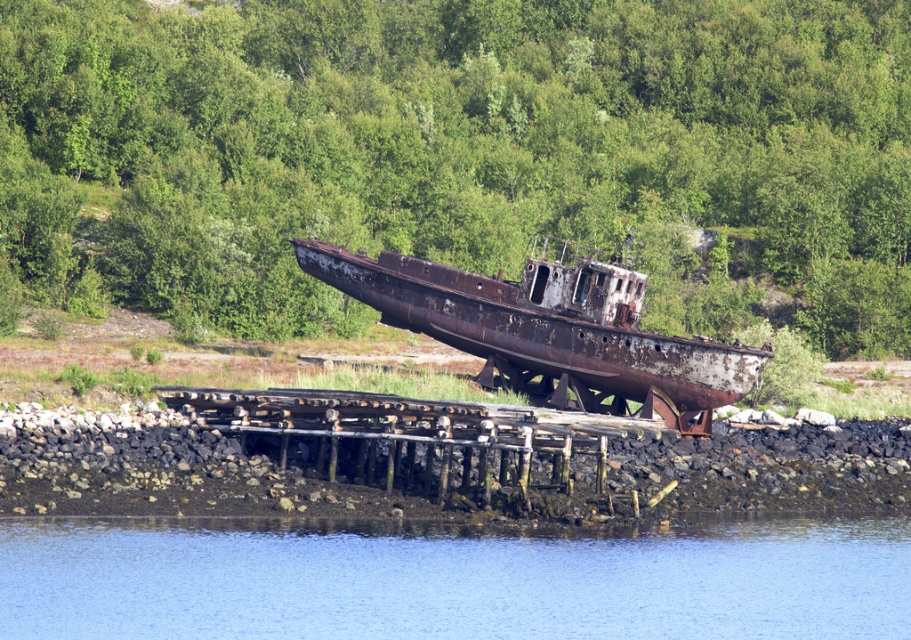
Between blue water at lower center and rusty metal boat at center, which one is positioned higher?

rusty metal boat at center

Which is in front, point (497, 554) or point (517, 289)?

Point (497, 554) is more forward.

Between point (548, 545) and point (553, 340), which one is positioned behind?

The point (553, 340) is behind.

Where is `blue water at lower center`? blue water at lower center is located at coordinates (453, 580).

Between green leafy trees at upper center and blue water at lower center, which one is positioned lower?

blue water at lower center

What are the coordinates of `green leafy trees at upper center` in the screenshot? It's located at (471, 147).

Does point (874, 237) lie in front of point (828, 557)?

No, (874, 237) is behind (828, 557).

This screenshot has height=640, width=911. Identify the location of green leafy trees at upper center. (471, 147).

Measure the distance between point (899, 224) and camera.

Point (899, 224) is 78.86 meters from camera.

Which is above, green leafy trees at upper center or rusty metal boat at center?

green leafy trees at upper center

Between point (80, 44) and point (430, 292), which one is positioned behind?

The point (80, 44) is behind.

This screenshot has height=640, width=911. I want to click on green leafy trees at upper center, so click(471, 147).